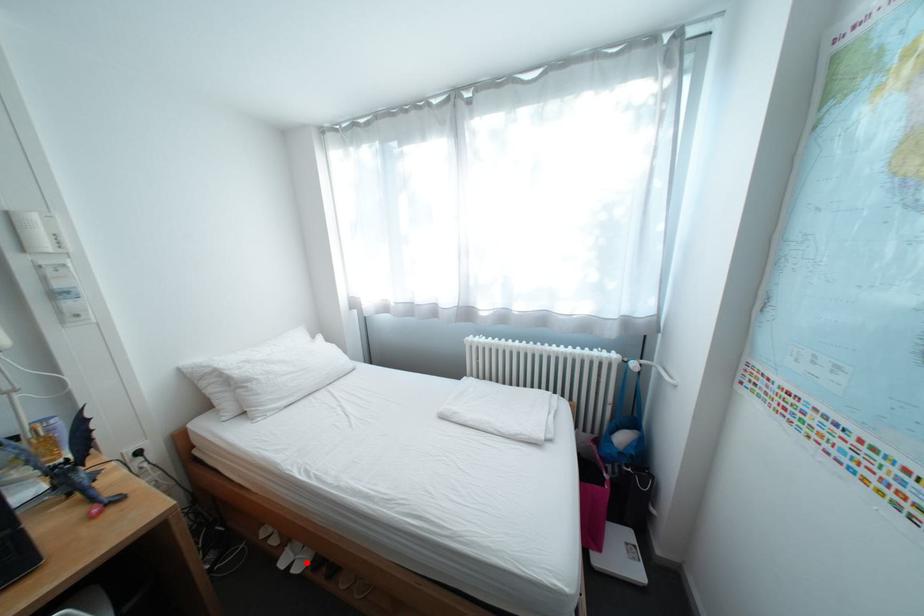
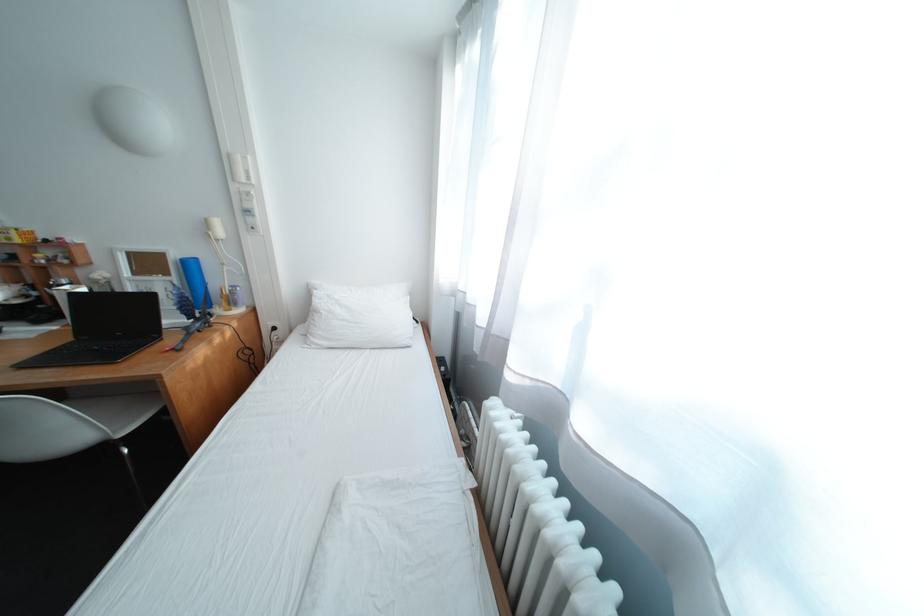
Question: I am providing you with two images of the same scene from different viewpoints. A red point is marked on the first image. Is the red point's position out of view in image 2?

Choices:
 (A) Yes
 (B) No

Answer: (A)